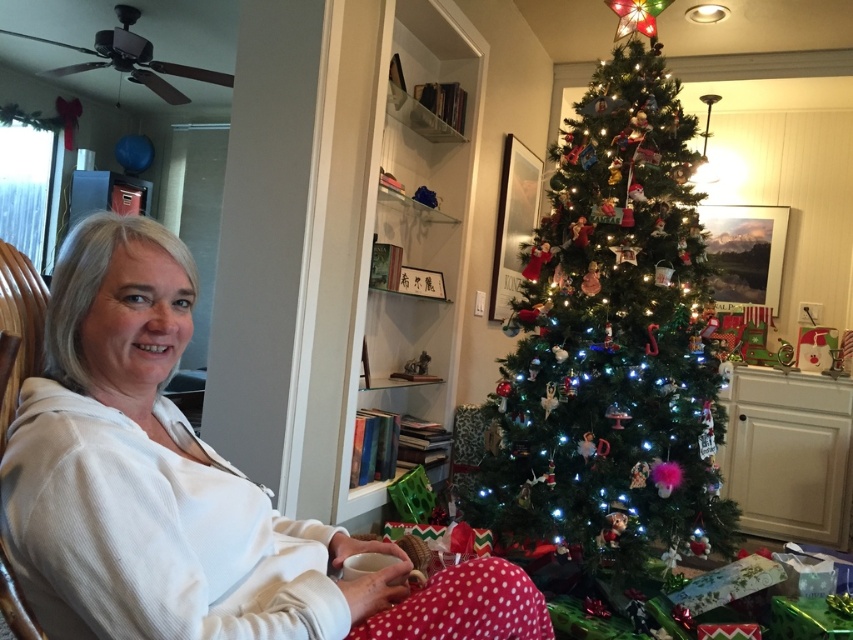
You are a guest in this holiday scene and want to place a small gift box on the table between the white soft sweater at center and the green matte christmas tree at center. Based on their widths, which object should you place the gift box closer to?

The white soft sweater at center has a lesser width compared to the green matte christmas tree at center, so you should place the gift box closer to the green matte christmas tree at center to ensure enough space.

You are standing in the living room and want to place a new decoration on the Christmas tree. The decoration requires a space of 36 inches from the viewer to be safely placed. Is the point at coordinate point [212,486] within the safe distance for placing the decoration?

The distance between point [212,486] and the viewer is 38.37 inches, which is greater than the required 36 inches. Therefore, the point at coordinate point [212,486] is within the safe distance for placing the decoration.